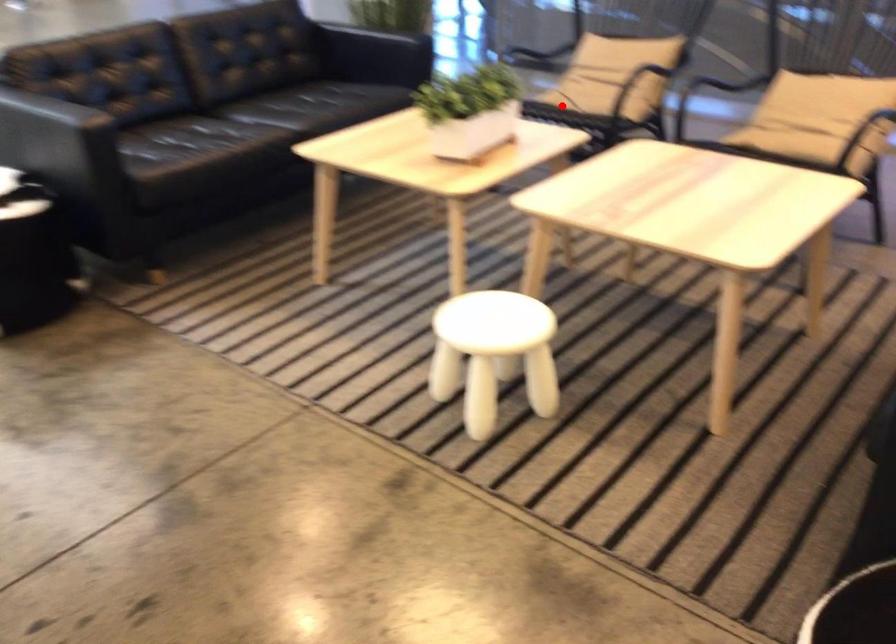
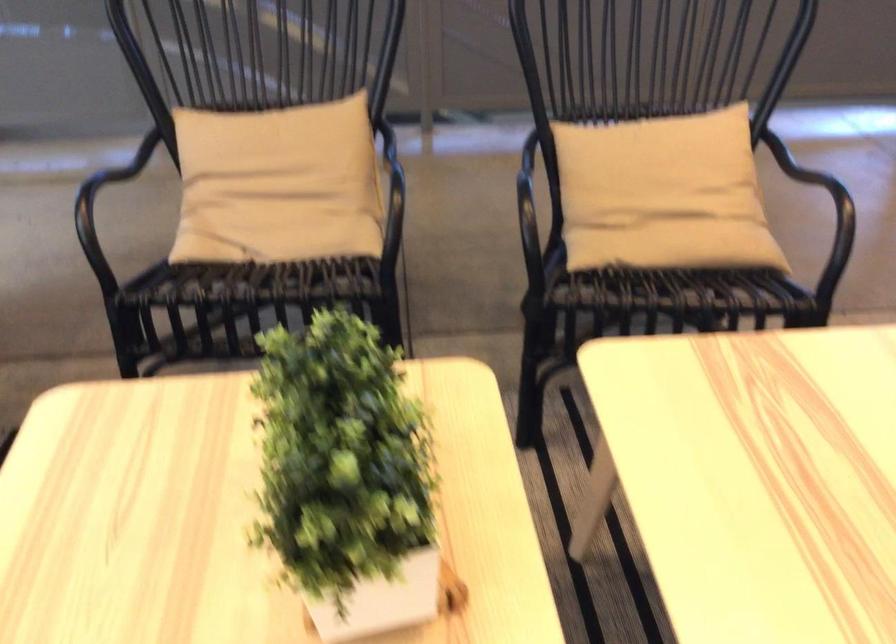
Question: I am providing you with two images of the same scene from different viewpoints. Given a red point in image1, look at the same physical point in image2. Is it:

Choices:
 (A) Closer to the viewpoint
 (B) Farther from the viewpoint

Answer: (A)